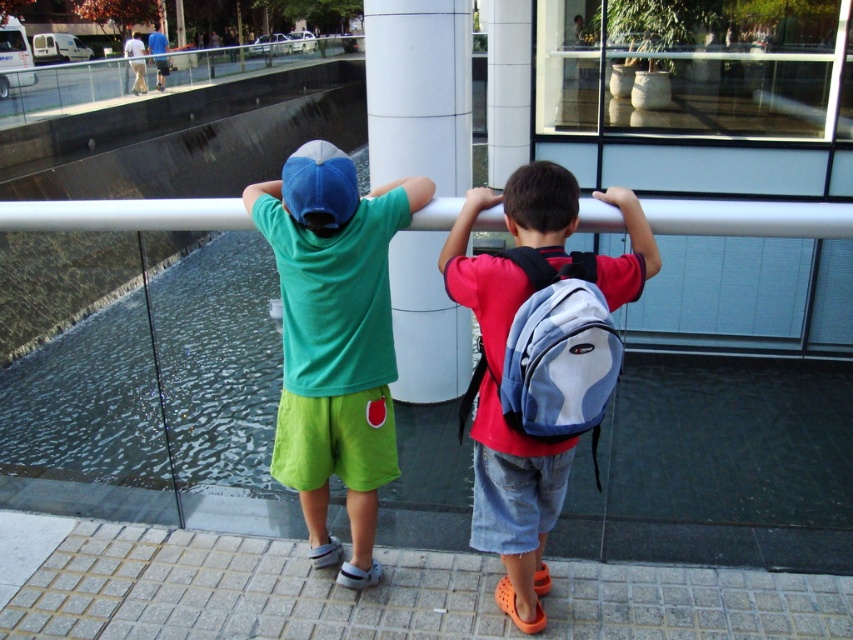
You are a photographer trying to capture a photo of the blue denim shorts at center and the blue fabric backpack at center. Since both are blue, you want to ensure they are clearly distinguishable in the image. Based on their positions, which object should you focus on first to make sure it appears sharp in the photo?

The blue denim shorts at center is below blue fabric backpack at center. Therefore, you should focus on the blue fabric backpack at center first since it is closer to the camera, ensuring it stays sharp while the background elements may blur slightly.

You are a delivery drone preparing to land on the paved area where the blue denim shorts at center and the white smooth pillar at center are located. The minimum safe distance required for landing is 6 meters between any obstacles. Based on the scene, can you safely land here?

The blue denim shorts at center and white smooth pillar at center are 5.94 meters apart from each other, which is less than the required 6 meters for safe landing. Therefore, it is not safe to land here.

You are a photographer trying to capture a shot of the white smooth pillar at center and the blue fabric backpack at center. Since the pillar is blocking the backpack, can you adjust your angle to include both in the frame without moving any objects?

The white smooth pillar at center is positioned over the blue fabric backpack at center, so adjusting your angle might allow you to capture both by tilting the camera slightly downward to include the backpack beneath the pillar.